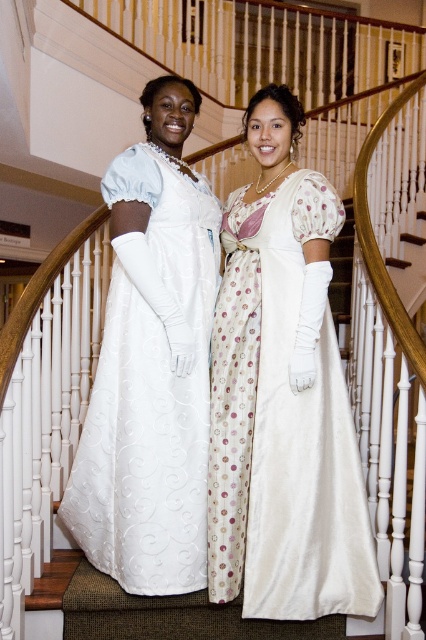
You are an interior designer assessing the placement of a new chandelier in this historical staircase. The chandelier must be positioned exactly at the point with coordinates point (282, 426). Based on the image description, which object will the chandelier be placed closest to?

The point (282, 426) corresponds to the silky white gown at center, so the chandelier will be placed closest to the silky white gown at center.

Based on the photo, you are a photographer setting up for a photoshoot in this scene. You need to position a backdrop behind both the silky white gown at center and the white satin dress at center. Since the backdrop is limited in width, which of the two garments should be placed closer to the center to ensure both fit within the frame?

The silky white gown at center is larger in size than the white satin dress at center, so placing the smaller white satin dress at center closer to the center would allow both garments to fit within the backdrop frame.

You are a photographer positioned at the bottom of the staircase. You need to capture a photo of both the silky white gown at center and the white satin dress at center. Which gown should you focus on first if you want to start with the one closer to the left side?

The white satin dress at center is closer to the left side, so you should focus on it first.